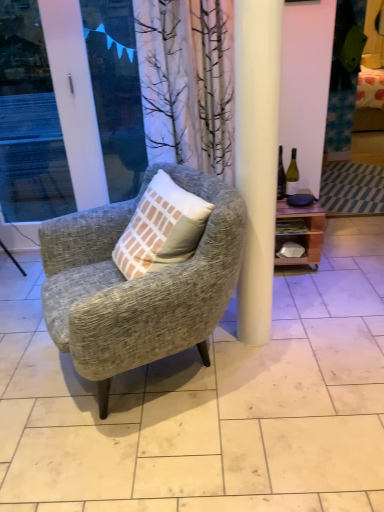
Question: From the image's perspective, is white glossy screen door at left located above or below textured gray armchair at center?

Choices:
 (A) below
 (B) above

Answer: (B)

Question: Is white glossy screen door at left to the left or to the right of textured gray armchair at center in the image?

Choices:
 (A) right
 (B) left

Answer: (B)

Question: Which is farther from the textured gray armchair at center?

Choices:
 (A) green glass bottle at right
 (B) white glossy screen door at left
 (C) wooden shelf at right

Answer: (B)

Question: Estimate the real-world distances between objects in this image. Which object is farther from the textured gray armchair at center?

Choices:
 (A) white glossy screen door at left
 (B) green glass bottle at right
 (C) wooden shelf at right

Answer: (A)